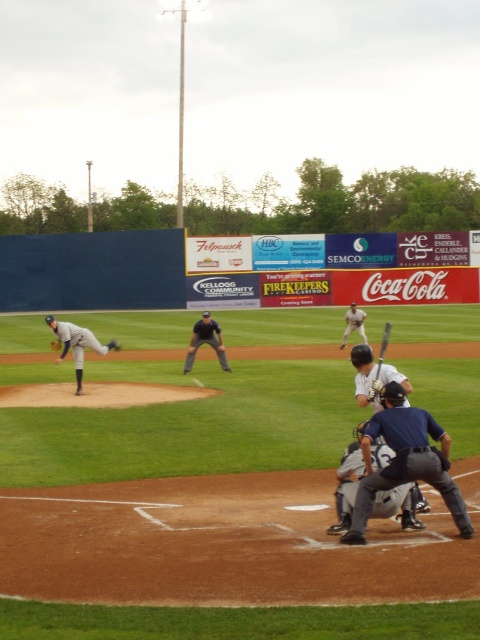
Can you confirm if dark blue uniform at lower right is positioned to the right of white jersey baseball bat at center?

Incorrect, dark blue uniform at lower right is not on the right side of white jersey baseball bat at center.

Can you confirm if dark blue uniform at lower right is wider than white jersey baseball bat at center?

Incorrect, dark blue uniform at lower right's width does not surpass white jersey baseball bat at center's.

At what (x,y) coordinates should I click in order to perform the action: click on dark blue uniform at lower right. Please return your answer as a coordinate pair (x, y). Looking at the image, I should click on (405, 461).

Can you confirm if white matte baseball bat at center is positioned above dark blue leather glove at center?

Actually, white matte baseball bat at center is below dark blue leather glove at center.

Is white matte baseball bat at center to the right of dark blue leather glove at center from the viewer's perspective?

Yes, white matte baseball bat at center is to the right of dark blue leather glove at center.

Is point (360, 394) closer to camera compared to point (116, 340)?

Yes, it is.

What are the coordinates of `white matte baseball bat at center` in the screenshot? It's located at (372, 378).

Find the location of a particular element. dark blue uniform at lower right is located at coordinates (405, 461).

Can you confirm if dark blue uniform at lower right is positioned above dark brown leather glove at left?

Incorrect, dark blue uniform at lower right is not positioned above dark brown leather glove at left.

Does point (440, 435) lie behind point (54, 349)?

No.

Locate an element on the screen. The image size is (480, 640). dark blue uniform at lower right is located at coordinates (405, 461).